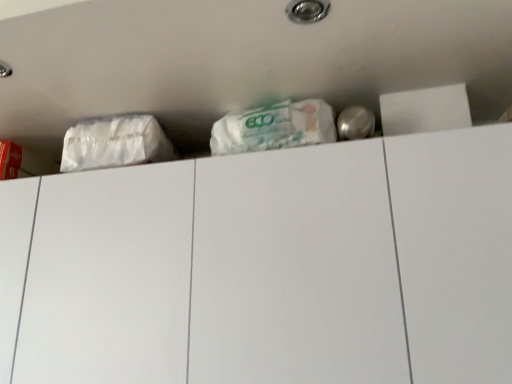
Question: From a real-world perspective, relative to white matte plastic bag at upper left, is white matte drawer at upper center vertically above or below?

Choices:
 (A) below
 (B) above

Answer: (A)

Question: In the image, is white matte drawer at upper center on the left side or the right side of white matte plastic bag at upper left?

Choices:
 (A) right
 (B) left

Answer: (A)

Question: From the image's perspective, is white matte drawer at upper center above or below white matte plastic bag at upper left?

Choices:
 (A) below
 (B) above

Answer: (A)

Question: In terms of height, does white matte plastic bag at upper left look taller or shorter compared to white matte drawer at upper center?

Choices:
 (A) tall
 (B) short

Answer: (B)

Question: Is white matte plastic bag at upper left inside the boundaries of white matte drawer at upper center, or outside?

Choices:
 (A) outside
 (B) inside

Answer: (A)

Question: Would you say white matte plastic bag at upper left is to the left or to the right of white matte drawer at upper center in the picture?

Choices:
 (A) left
 (B) right

Answer: (A)

Question: From the image's perspective, is white matte plastic bag at upper left located above or below white matte drawer at upper center?

Choices:
 (A) below
 (B) above

Answer: (B)